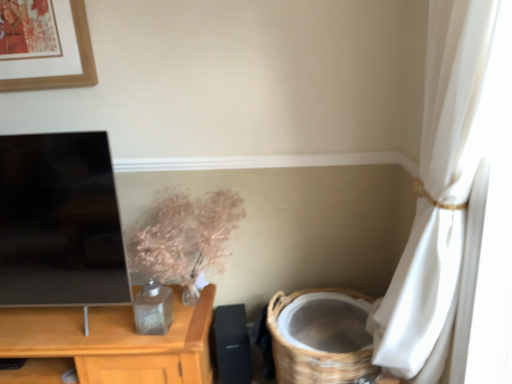
Question: Should I look upward or downward to see woven brown basket at lower right?

Choices:
 (A) down
 (B) up

Answer: (A)

Question: Is woven brown basket at lower right outside black matte speaker at lower center?

Choices:
 (A) yes
 (B) no

Answer: (A)

Question: Is woven brown basket at lower right further to the viewer compared to black matte speaker at lower center?

Choices:
 (A) yes
 (B) no

Answer: (B)

Question: Could you tell me if woven brown basket at lower right is turned towards black matte speaker at lower center?

Choices:
 (A) yes
 (B) no

Answer: (B)

Question: Is woven brown basket at lower right beside black matte speaker at lower center?

Choices:
 (A) yes
 (B) no

Answer: (B)

Question: Is woven brown basket at lower right in front of black matte speaker at lower center?

Choices:
 (A) yes
 (B) no

Answer: (A)

Question: From a real-world perspective, is woven brown basket at lower right positioned under black matte speaker at lower center based on gravity?

Choices:
 (A) yes
 (B) no

Answer: (B)

Question: Is black matte speaker at lower center at the right side of woven brown basket at lower right?

Choices:
 (A) yes
 (B) no

Answer: (B)

Question: From a real-world perspective, does black matte speaker at lower center sit lower than woven brown basket at lower right?

Choices:
 (A) no
 (B) yes

Answer: (B)

Question: Is black matte speaker at lower center not inside woven brown basket at lower right?

Choices:
 (A) yes
 (B) no

Answer: (A)

Question: Can woven brown basket at lower right be found inside black matte speaker at lower center?

Choices:
 (A) no
 (B) yes

Answer: (A)

Question: Is the depth of black matte speaker at lower center greater than that of woven brown basket at lower right?

Choices:
 (A) no
 (B) yes

Answer: (B)

Question: Does black matte speaker at lower center appear on the left side of woven brown basket at lower right?

Choices:
 (A) no
 (B) yes

Answer: (B)

Question: Does black matte speaker at lower center have a greater width compared to metallic floral arrangement at center?

Choices:
 (A) yes
 (B) no

Answer: (B)